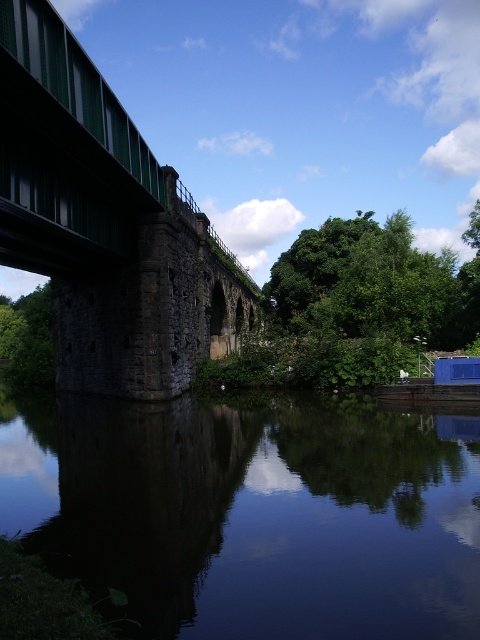
You are an artist setting up your easel to paint the riverside scene. You want to capture both the green metallic bridge at left and the green leafy tree at lower left in your painting. Which object should you place closer to the center of your canvas to ensure it takes up more visual space?

The green leafy tree at lower left should be placed closer to the center of the canvas because it occupies more space than the green metallic bridge at left.

You are standing on the stone bridge and looking down. You see the dark reflective water at lower center and the green leafy tree at center. Which object is closer to you from your current viewpoint?

The dark reflective water at lower center is closer to you because it is in front of the green leafy tree at center.